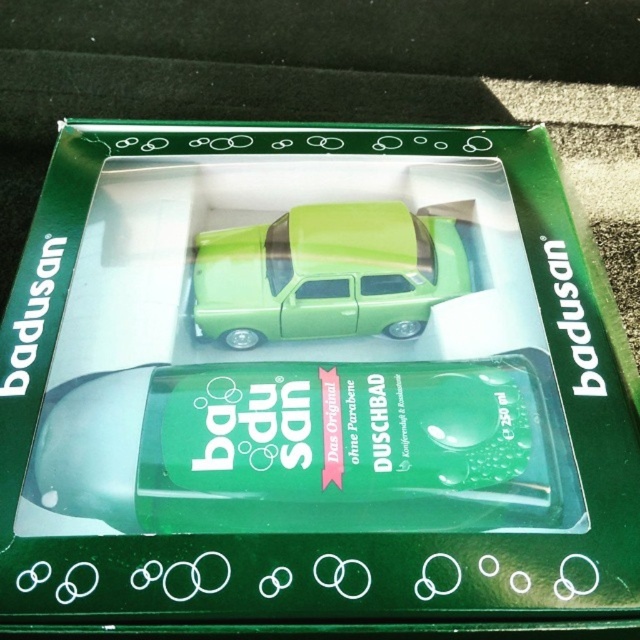
Where is `green plastic car at center`? The width and height of the screenshot is (640, 640). green plastic car at center is located at coordinates (301, 448).

Based on the photo, can you confirm if green plastic car at center is thinner than green glossy car at center?

No, green plastic car at center is not thinner than green glossy car at center.

Locate an element on the screen. The height and width of the screenshot is (640, 640). green plastic car at center is located at coordinates (301, 448).